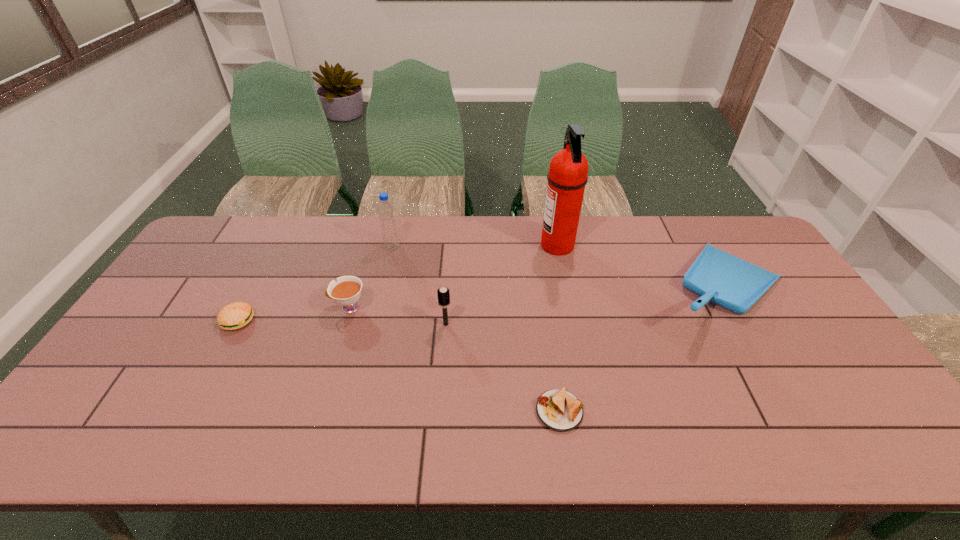
The width and height of the screenshot is (960, 540). Find the location of `the shortest object`. the shortest object is located at coordinates (558, 409).

The width and height of the screenshot is (960, 540). What are the coordinates of `free spot located 0.280m on the side of the tallest object near the handle` in the screenshot? It's located at (458, 246).

What are the coordinates of `vacant region located on the side of the tallest object near the handle` in the screenshot? It's located at (519, 246).

The width and height of the screenshot is (960, 540). Identify the location of vacant space located 0.220m on the side of the tallest object near the handle. point(475,246).

Where is `free region located on the left of the second tallest object`? free region located on the left of the second tallest object is located at coordinates (310, 247).

Locate an element on the screen. The image size is (960, 540). free space located 0.190m on the left of the rightmost object is located at coordinates [593, 288].

Find the location of a particular element. This screenshot has height=540, width=960. free space located 0.380m on the back of the fourth object from right to left is located at coordinates (452, 238).

The height and width of the screenshot is (540, 960). In order to click on free space located 0.390m on the side of the teacup with the handle in this screenshot , I will do `click(197, 307)`.

At what (x,y) coordinates should I click in order to perform the action: click on free space located on the side of the teacup with the handle. Please return your answer as a coordinate pair (x, y). The height and width of the screenshot is (540, 960). Looking at the image, I should click on (252, 307).

Image resolution: width=960 pixels, height=540 pixels. What are the coordinates of `vacant area located 0.120m on the side of the teacup with the handle` in the screenshot? It's located at (289, 307).